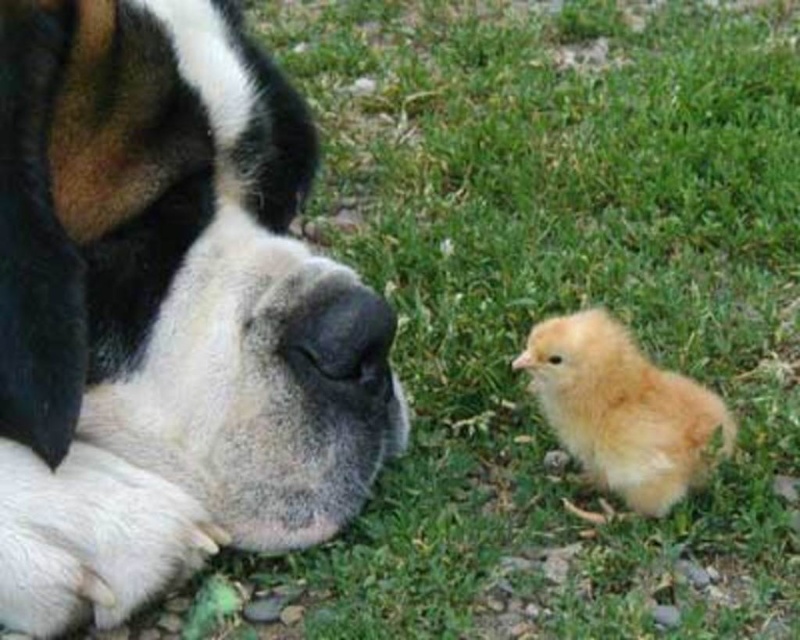
Question: Which object is farther from the camera taking this photo?

Choices:
 (A) black matte nose at lower center
 (B) white fur dog at center

Answer: (A)

Question: In this image, where is green grass at lower right located relative to white fur dog at center?

Choices:
 (A) right
 (B) left

Answer: (A)

Question: Estimate the real-world distances between objects in this image. Which object is closer to the black matte nose at lower center?

Choices:
 (A) golden fluffy chick at lower right
 (B) green grass at lower right
 (C) soft yellow down at lower right
 (D) white fur dog at center

Answer: (D)

Question: Considering the relative positions of white fur dog at center and black matte nose at lower center in the image provided, where is white fur dog at center located with respect to black matte nose at lower center?

Choices:
 (A) above
 (B) below

Answer: (A)

Question: Can you confirm if golden fluffy chick at lower right is positioned above soft yellow down at lower right?

Choices:
 (A) no
 (B) yes

Answer: (A)

Question: Which point is closer to the camera?

Choices:
 (A) white fur dog at center
 (B) golden fluffy chick at lower right

Answer: (A)